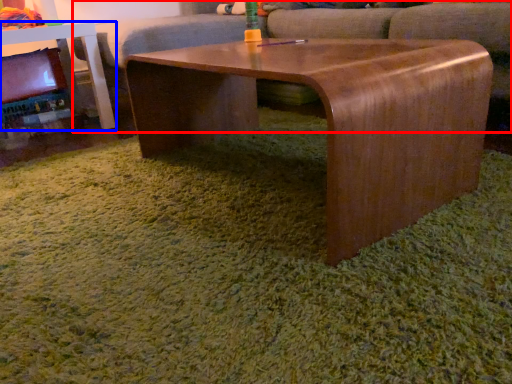
Question: Which of the following is the farthest to the observer, couch (highlighted by a red box) or table (highlighted by a blue box)?

Choices:
 (A) couch
 (B) table

Answer: (B)